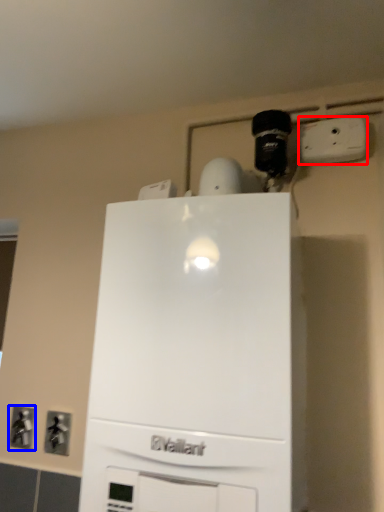
Question: Which of the following is the closest to the observer, electric outlet (highlighted by a red box) or electric outlet (highlighted by a blue box)?

Choices:
 (A) electric outlet
 (B) electric outlet

Answer: (A)